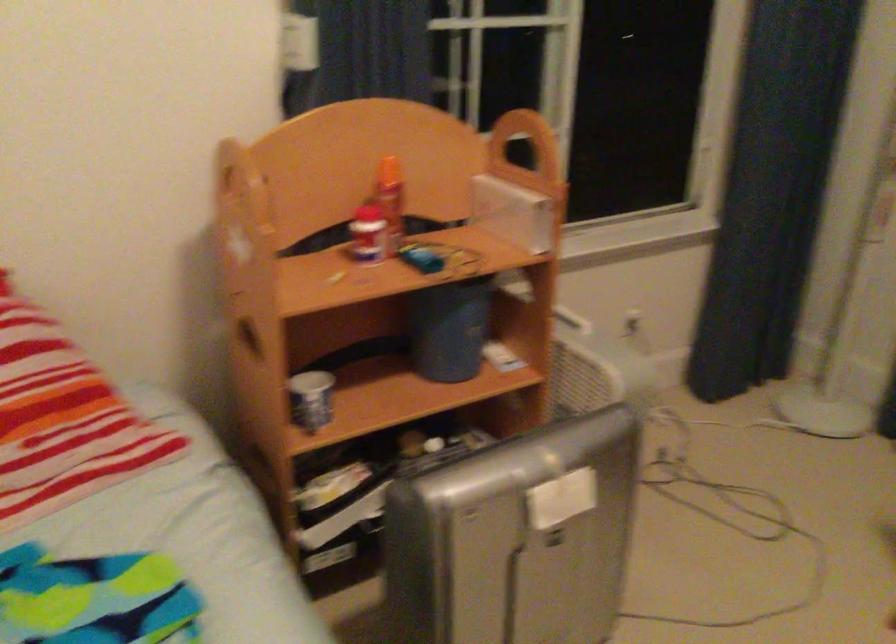
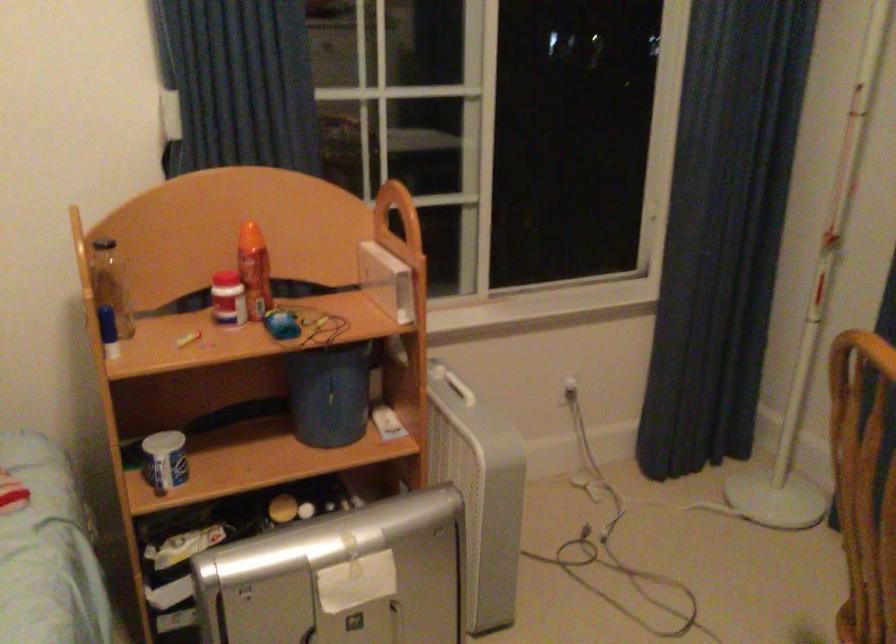
Locate, in the second image, the point that corresponds to pixel 638 319 in the first image.

(564, 392)